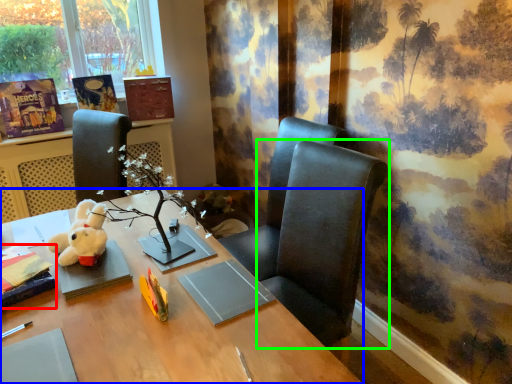
Question: Which is farther away from book (highlighted by a red box)? desk (highlighted by a blue box) or chair (highlighted by a green box)?

Choices:
 (A) desk
 (B) chair

Answer: (B)